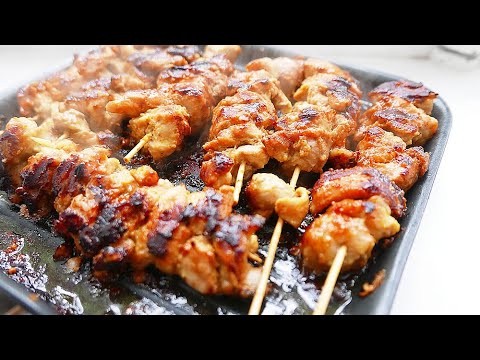
I want to click on counter, so click(462, 138).